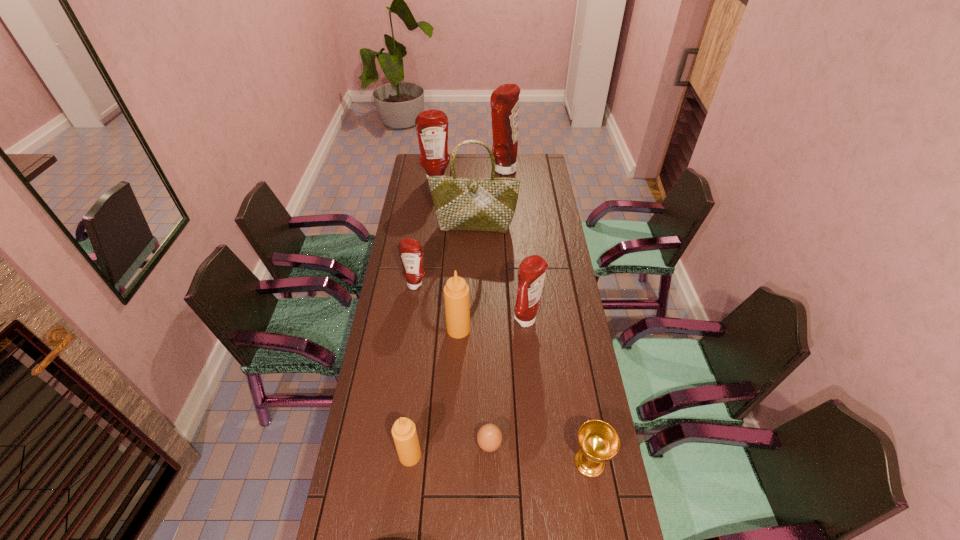
You are a GUI agent. You are given a task and a screenshot of the screen. Output one action in this format:
    pyautogui.click(x=<x>, y=<y>)
    Task: Click on the tallest condiment
    This screenshot has width=960, height=540.
    Given the screenshot: What is the action you would take?
    504,100

I want to click on the third farthest object, so pos(461,204).

Identify the location of green shopping bag. The image size is (960, 540). (461, 204).

Where is `the seventh shortest object`? This screenshot has width=960, height=540. the seventh shortest object is located at coordinates (432, 125).

Where is `the second biggest red condiment`? the second biggest red condiment is located at coordinates (432, 125).

The width and height of the screenshot is (960, 540). Identify the location of the farther tan condiment. (456, 291).

This screenshot has width=960, height=540. Identify the location of the fourth condiment from left to right. (456, 291).

Where is `the nearest red condiment`? Image resolution: width=960 pixels, height=540 pixels. the nearest red condiment is located at coordinates (x=532, y=270).

Image resolution: width=960 pixels, height=540 pixels. Find the location of `the fourth nearest condiment`. the fourth nearest condiment is located at coordinates point(410,250).

Where is `the fourth farthest object`? The image size is (960, 540). the fourth farthest object is located at coordinates pyautogui.click(x=410, y=250).